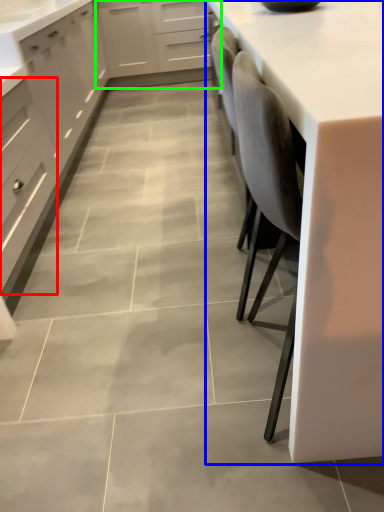
Question: Based on their relative distances, which object is farther from drawer (highlighted by a red box)? Choose from countertop (highlighted by a blue box) and cabinetry (highlighted by a green box).

Choices:
 (A) countertop
 (B) cabinetry

Answer: (B)